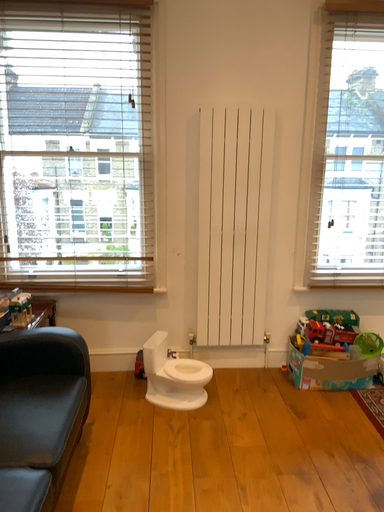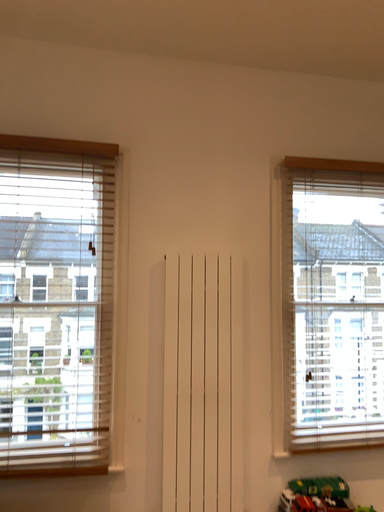
Question: Which way did the camera rotate in the video?

Choices:
 (A) rotated right
 (B) rotated left

Answer: (A)